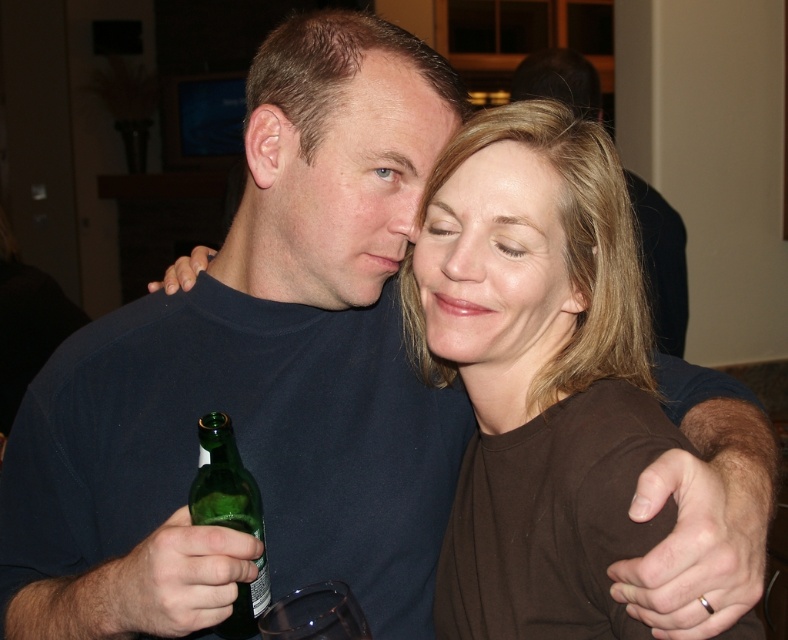
You are a photographer trying to capture a candid shot of the matte blue shirt at center and the green glass bottle at lower left. To ensure both subjects are in focus, you need to know their relative positions. Which object is located to the right of the other?

The matte blue shirt at center is positioned on the right side of green glass bottle at lower left, so the matte blue shirt at center is to the right of the green glass bottle at lower left.

You are a photographer adjusting lighting for a portrait. You notice the matte blue shirt at center and the matte black shirt at center in the frame. Which shirt should you focus your lighting on to ensure it stands out more against the background?

The matte blue shirt at center is positioned under the matte black shirt at center. Since the black shirt is on top, focusing lighting on the matte blue shirt at center would make it stand out more against the background.